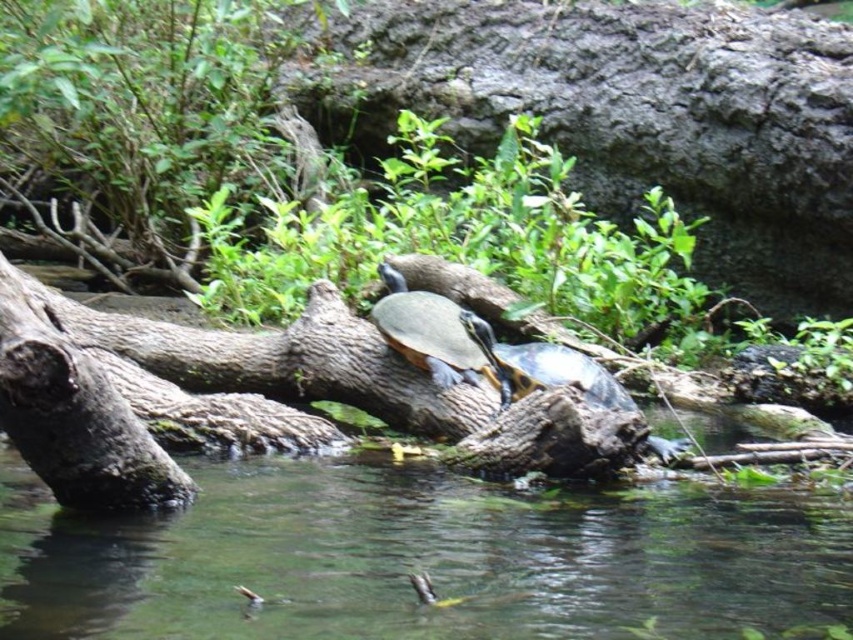
Who is lower down, shiny green tortoise at center or shiny brown tortoise at center?

shiny brown tortoise at center is lower down.

I want to click on shiny green tortoise at center, so click(428, 332).

Identify the location of shiny green tortoise at center. The height and width of the screenshot is (640, 853). (428, 332).